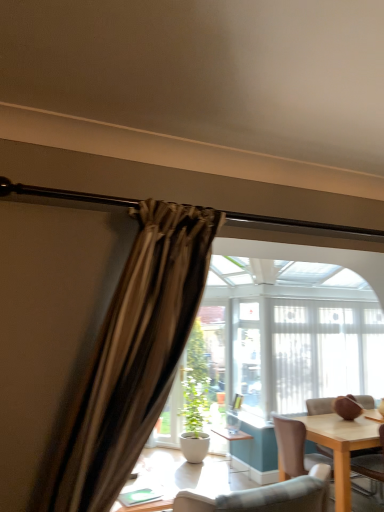
Question: Considering the relative sizes of white matte pot at center and white sheer curtain at center in the image provided, is white matte pot at center taller than white sheer curtain at center?

Choices:
 (A) no
 (B) yes

Answer: (A)

Question: Is white matte pot at center further to the viewer compared to white sheer curtain at center?

Choices:
 (A) yes
 (B) no

Answer: (A)

Question: Is white matte pot at center with white sheer curtain at center?

Choices:
 (A) no
 (B) yes

Answer: (A)

Question: Can white sheer curtain at center be found inside white matte pot at center?

Choices:
 (A) no
 (B) yes

Answer: (A)

Question: From a real-world perspective, is white matte pot at center physically above white sheer curtain at center?

Choices:
 (A) no
 (B) yes

Answer: (A)

Question: In terms of size, does white matte pot at center appear bigger or smaller than white sheer curtain at center?

Choices:
 (A) small
 (B) big

Answer: (A)

Question: Considering the positions of point (205, 401) and point (304, 397), is point (205, 401) closer or farther from the camera than point (304, 397)?

Choices:
 (A) farther
 (B) closer

Answer: (B)

Question: Based on their positions, is white matte pot at center located to the left or right of white sheer curtain at center?

Choices:
 (A) left
 (B) right

Answer: (A)

Question: Considering the positions of white matte pot at center and white sheer curtain at center in the image, is white matte pot at center wider or thinner than white sheer curtain at center?

Choices:
 (A) wide
 (B) thin

Answer: (A)

Question: Do you think wooden chair at right is within white sheer curtain at center, or outside of it?

Choices:
 (A) outside
 (B) inside

Answer: (A)

Question: Considering their positions, is wooden chair at right located in front of or behind white sheer curtain at center?

Choices:
 (A) behind
 (B) front

Answer: (B)

Question: From the image's perspective, relative to white sheer curtain at center, is wooden chair at right above or below?

Choices:
 (A) below
 (B) above

Answer: (A)

Question: From a real-world perspective, is wooden chair at right above or below white sheer curtain at center?

Choices:
 (A) below
 (B) above

Answer: (A)

Question: Which is correct: white matte pot at center is inside wooden chair at right, or outside of it?

Choices:
 (A) outside
 (B) inside

Answer: (A)

Question: In the image, is white matte pot at center on the left side or the right side of wooden chair at right?

Choices:
 (A) right
 (B) left

Answer: (B)